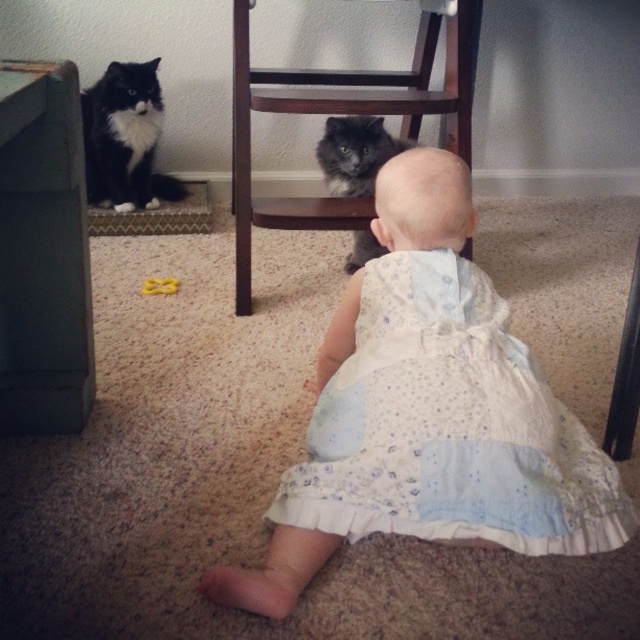
Question: From the image, what is the correct spatial relationship of wooden chair at center in relation to black fluffy cat at upper left?

Choices:
 (A) right
 (B) left

Answer: (A)

Question: Which object appears closest to the camera in this image?

Choices:
 (A) black fluffy cat at upper left
 (B) fluffy gray cat at center
 (C) wooden chair at center

Answer: (C)

Question: Considering the real-world distances, which object is farthest from the black fluffy cat at upper left?

Choices:
 (A) wooden chair at center
 (B) white dotted fabric dress at center
 (C) fluffy gray cat at center

Answer: (B)

Question: Which object is the farthest from the white dotted fabric dress at center?

Choices:
 (A) fluffy gray cat at center
 (B) black fluffy cat at upper left

Answer: (B)

Question: Is white dotted fabric dress at center to the right of black fluffy cat at upper left from the viewer's perspective?

Choices:
 (A) yes
 (B) no

Answer: (A)

Question: Does black fluffy cat at upper left appear on the left side of fluffy gray cat at center?

Choices:
 (A) yes
 (B) no

Answer: (A)